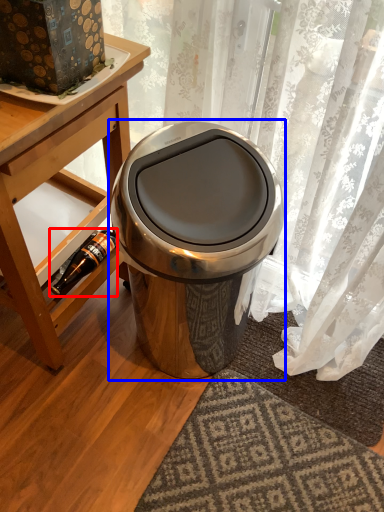
Question: Which object is closer to the camera taking this photo, bottle (highlighted by a red box) or waste container (highlighted by a blue box)?

Choices:
 (A) bottle
 (B) waste container

Answer: (B)